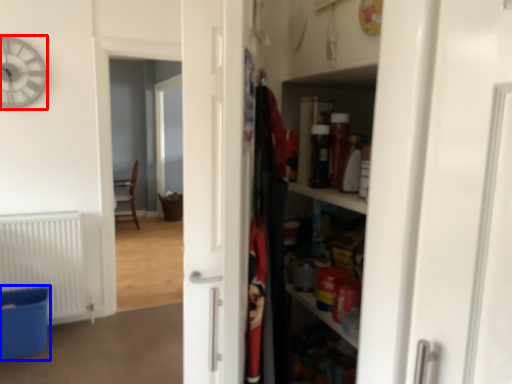
Question: Which object appears closest to the camera in this image, clock (highlighted by a red box) or laundry basket (highlighted by a blue box)?

Choices:
 (A) clock
 (B) laundry basket

Answer: (B)